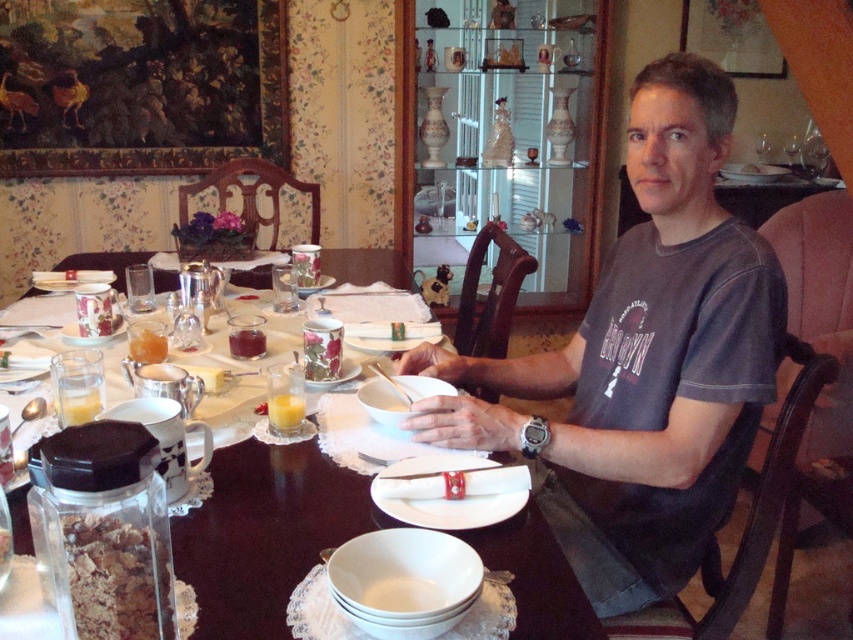
Question: Which object is closer to the camera taking this photo?

Choices:
 (A) white ceramic plate at upper center
 (B) gray cotton t-shirt at center
 (C) white matte plate at center
 (D) white porcelain plate at center

Answer: (C)

Question: Can you confirm if white paper napkin at center is positioned below white porcelain plate at center?

Choices:
 (A) yes
 (B) no

Answer: (A)

Question: Which point is closer to the camera?

Choices:
 (A) (415, 460)
 (B) (581, 598)
 (C) (144, 561)
 (D) (759, 168)

Answer: (C)

Question: Based on their relative distances, which object is farther from the white porcelain plate at center?

Choices:
 (A) white porcelain table at center
 (B) gray cotton t-shirt at center
 (C) white ceramic plate at upper center

Answer: (C)

Question: Does gray cotton t-shirt at center have a greater width compared to white matte plate at center?

Choices:
 (A) no
 (B) yes

Answer: (B)

Question: Is the position of white matte plate at center less distant than that of white paper napkin at center?

Choices:
 (A) no
 (B) yes

Answer: (B)